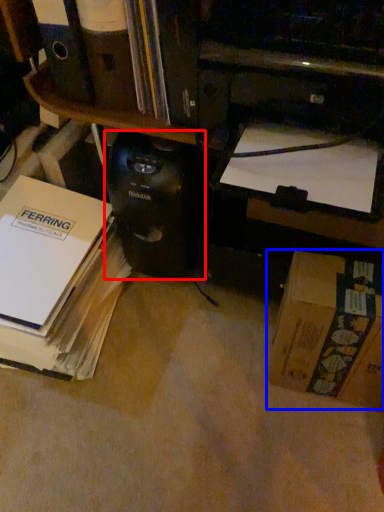
Question: Which object is further to the camera taking this photo, computer tower (highlighted by a red box) or box (highlighted by a blue box)?

Choices:
 (A) computer tower
 (B) box

Answer: (A)